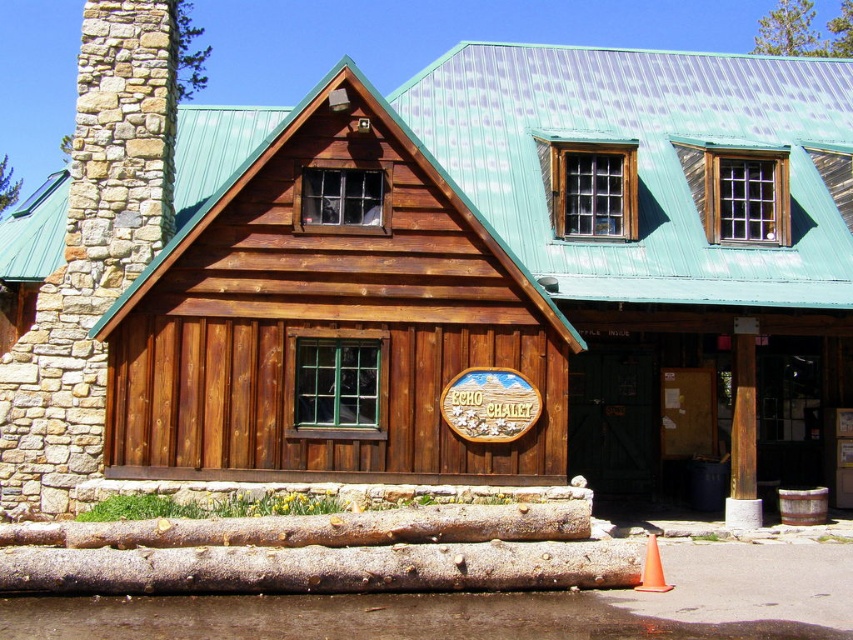
Between stained wood cabin at center and orange plastic cone at lower center, which one is positioned higher?

stained wood cabin at center is above.

Does stained wood cabin at center appear on the right side of orange plastic cone at lower center?

In fact, stained wood cabin at center is to the left of orange plastic cone at lower center.

Who is more distant from viewer, (544, 390) or (666, 584)?

The point (544, 390) is behind.

At what (x,y) coordinates should I click in order to perform the action: click on stained wood cabin at center. Please return your answer as a coordinate pair (x, y). Image resolution: width=853 pixels, height=640 pixels. Looking at the image, I should click on (337, 323).